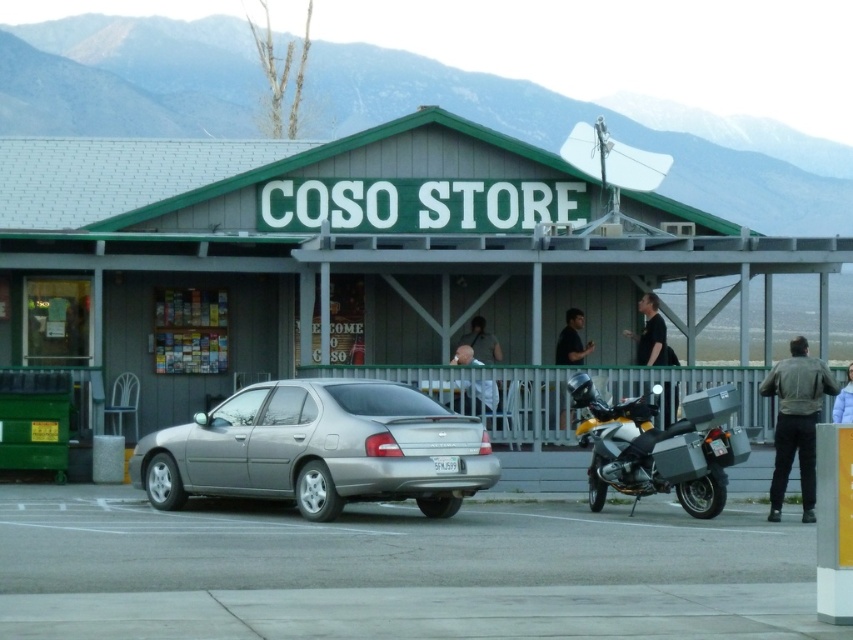
Between point (422, 556) and point (471, 323), which one is positioned in front?

Point (422, 556) is more forward.

Can you confirm if gray asphalt parking lot at lower center is smaller than white fabric shirt at center?

Actually, gray asphalt parking lot at lower center might be larger than white fabric shirt at center.

Who is more distant from viewer, (582, 600) or (479, 380)?

The point (479, 380) is behind.

Where is `gray asphalt parking lot at lower center`? gray asphalt parking lot at lower center is located at coordinates (395, 570).

Image resolution: width=853 pixels, height=640 pixels. I want to click on leather jacket at right, so click(x=796, y=420).

Does leather jacket at right have a greater width compared to black matte shirt at center?

No.

Between point (772, 476) and point (556, 364), which one is positioned in front?

Point (772, 476) is in front.

Locate an element on the screen. The image size is (853, 640). leather jacket at right is located at coordinates tap(796, 420).

Who is taller, white fabric shirt at center or white puffer jacket at lower right?

Standing taller between the two is white puffer jacket at lower right.

Can you confirm if white fabric shirt at center is bigger than white puffer jacket at lower right?

Actually, white fabric shirt at center might be smaller than white puffer jacket at lower right.

Between point (461, 342) and point (848, 376), which one is positioned in front?

Point (848, 376)

The width and height of the screenshot is (853, 640). Identify the location of white fabric shirt at center. (477, 346).